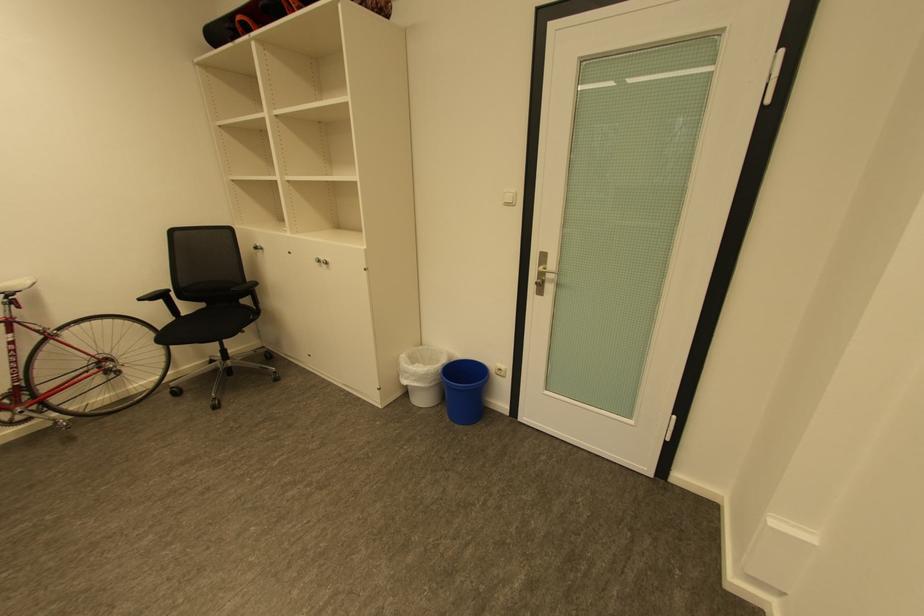
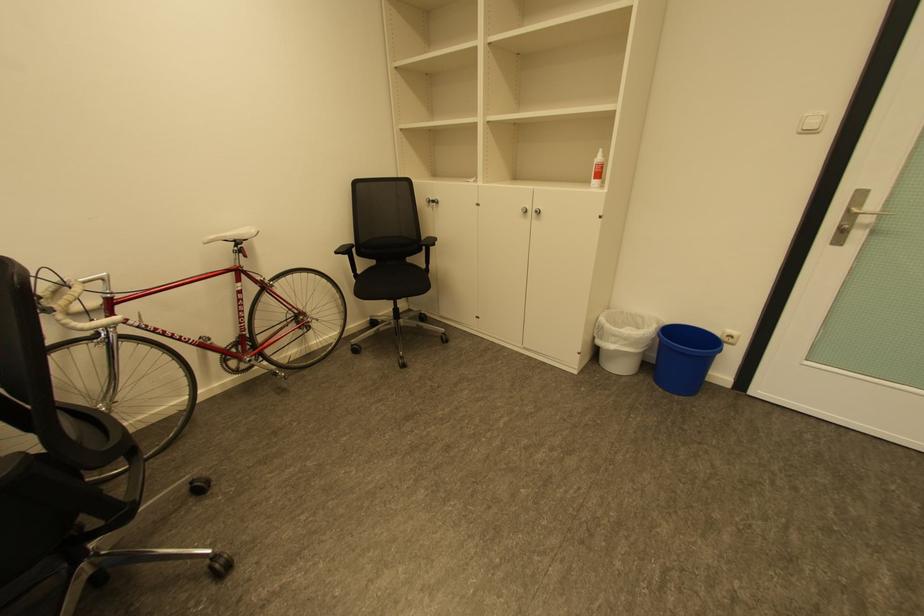
In the second image, find the point that corresponds to point (543, 294) in the first image.

(837, 245)